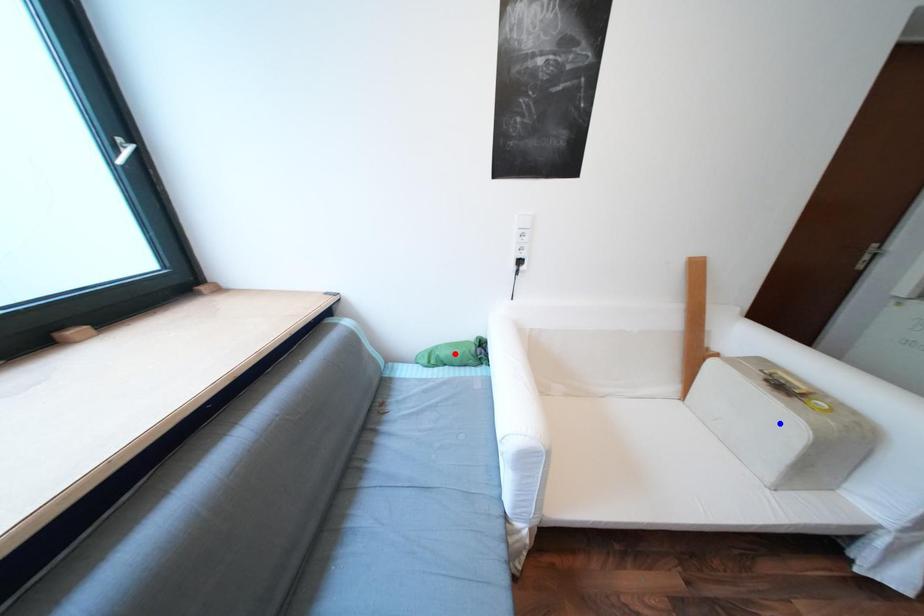
Question: In the image, two points are highlighted. Which point is nearer to the camera? Reply with the corresponding letter.

Choices:
 (A) blue point
 (B) red point

Answer: (A)